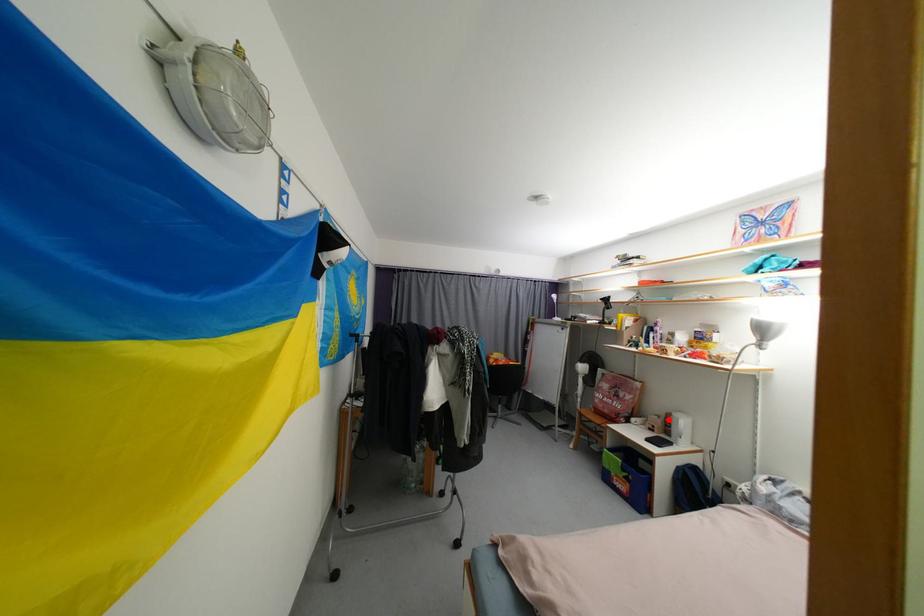
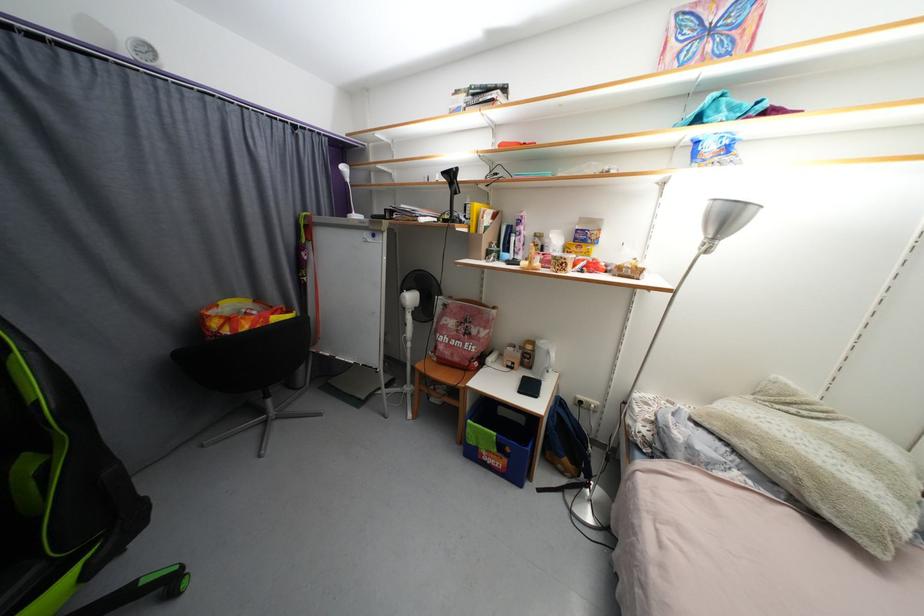
Locate, in the second image, the point that corresponds to the highlighted location in the first image.

(523, 349)